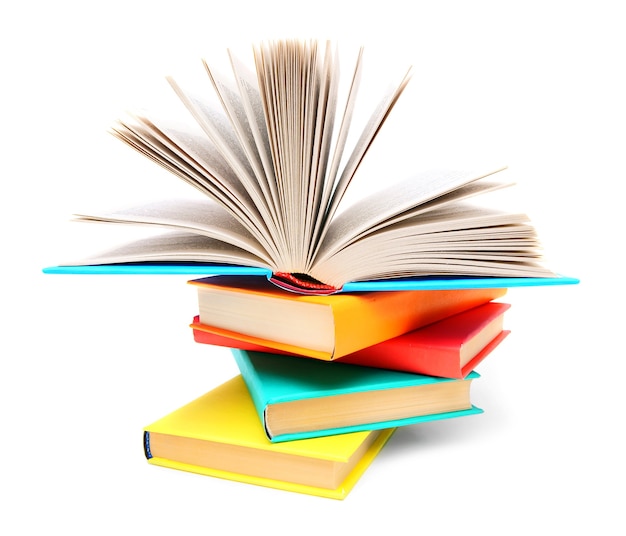
Locate an element on the screen. Image resolution: width=626 pixels, height=536 pixels. books is located at coordinates (309, 249), (356, 326), (424, 341), (389, 396), (294, 461).